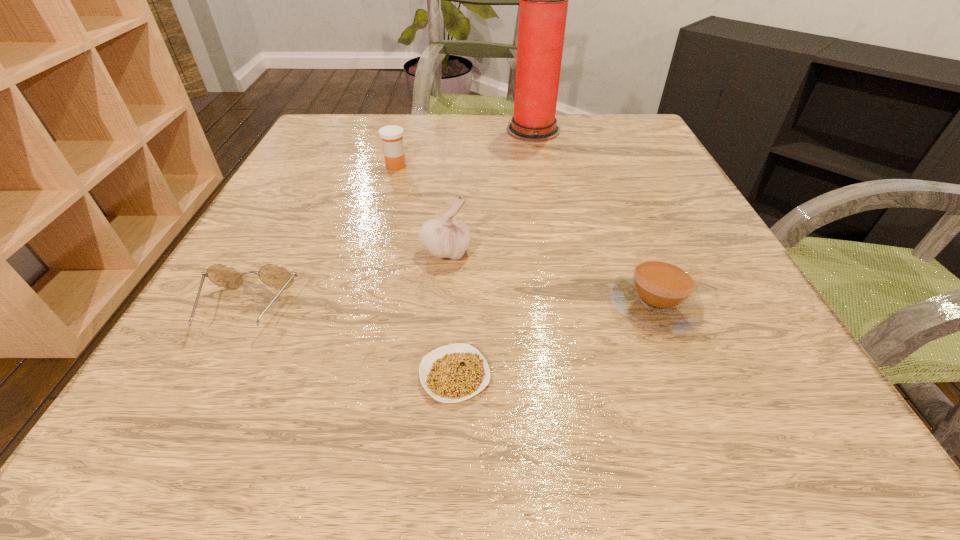
Where is `the nearest object`? The width and height of the screenshot is (960, 540). the nearest object is located at coordinates (453, 373).

Where is `vacant space positioned at the discharge end of the fire extinguisher`? The image size is (960, 540). vacant space positioned at the discharge end of the fire extinguisher is located at coordinates (479, 130).

Image resolution: width=960 pixels, height=540 pixels. I want to click on vacant space situated 0.340m at the discharge end of the fire extinguisher, so click(373, 130).

Identify the location of vacant area situated at the discharge end of the fire extinguisher. (479, 130).

Where is `vacant area located 0.300m on the left of the garlic`? The height and width of the screenshot is (540, 960). vacant area located 0.300m on the left of the garlic is located at coordinates [x=249, y=251].

The height and width of the screenshot is (540, 960). In order to click on free space located 0.250m on the label of the medicine in this screenshot , I will do `click(519, 166)`.

Image resolution: width=960 pixels, height=540 pixels. I want to click on blank space located 0.110m on the front of the cappuccino, so click(x=696, y=410).

At what (x,y) coordinates should I click in order to perform the action: click on vacant space situated 0.130m on the front-facing side of the second shortest object. Please return your answer as a coordinate pair (x, y). The image size is (960, 540). Looking at the image, I should click on (186, 422).

You are a GUI agent. You are given a task and a screenshot of the screen. Output one action in this format:
    pyautogui.click(x=<x>, y=<y>)
    Task: Click on the free space located on the right of the shortest object
    Image resolution: width=960 pixels, height=540 pixels.
    Given the screenshot: What is the action you would take?
    pyautogui.click(x=612, y=375)

Identify the location of object present at the far edge. (543, 6).